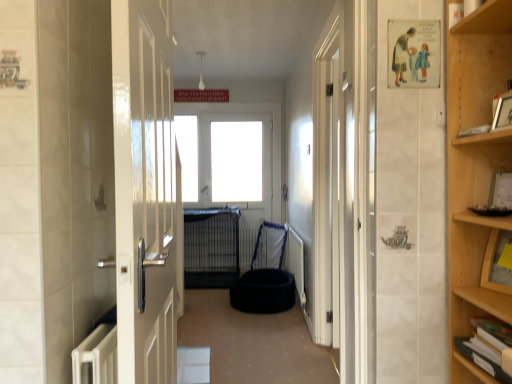
Question: Considering the positions of white glossy window at center and white plastic radiator at lower center in the image, is white glossy window at center taller or shorter than white plastic radiator at lower center?

Choices:
 (A) short
 (B) tall

Answer: (B)

Question: Is white glossy window at center inside or outside of white plastic radiator at lower center?

Choices:
 (A) inside
 (B) outside

Answer: (B)

Question: Which object is the closest to the hardcover book at lower right, which is the 1th book from bottom to top?

Choices:
 (A) white glossy door at center
 (B) black fabric bean bag at center
 (C) white plastic radiator at lower center
 (D) dark blue plush dog bed at center
 (E) wooden picture frame at upper right

Answer: (E)

Question: Which of these objects is positioned farthest from the black fabric bean bag at center?

Choices:
 (A) hardcover book at lower right, which is the 1th book from bottom to top
 (B) white glossy window at center
 (C) black wire cage at center
 (D) wooden picture frame at upper right
 (E) white plastic radiator at lower center

Answer: (D)